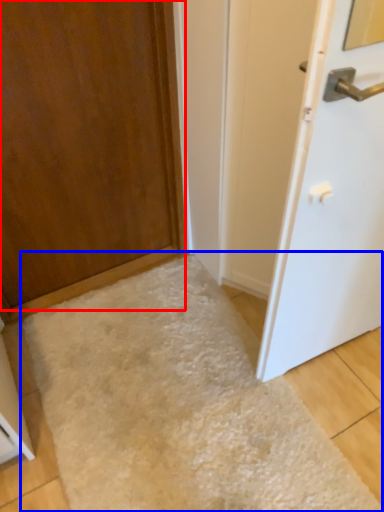
Question: Which object is closer to the camera taking this photo, door (highlighted by a red box) or flour (highlighted by a blue box)?

Choices:
 (A) door
 (B) flour

Answer: (A)